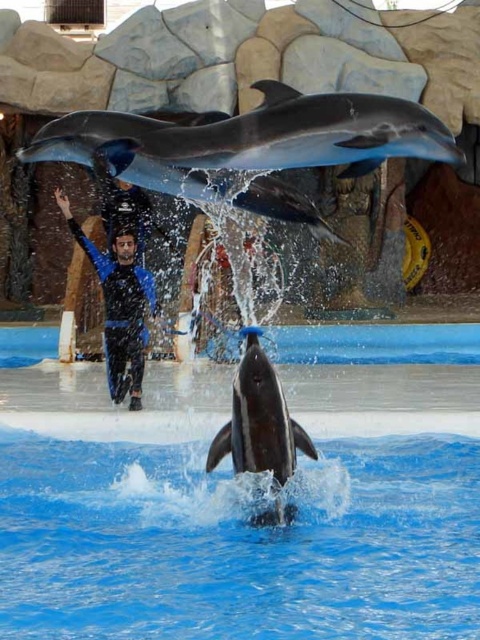
Does blue glossy water at center have a greater height compared to blue rubber suit at center?

No, blue glossy water at center is not taller than blue rubber suit at center.

Who is shorter, blue glossy water at center or blue rubber suit at center?

blue glossy water at center

Locate an element on the screen. This screenshot has width=480, height=640. blue glossy water at center is located at coordinates (243, 497).

Is the position of blue glossy water at center more distant than that of smooth gray dolphin at center?

No, it is not.

Is point (181, 412) less distant than point (277, 516)?

No, (181, 412) is behind (277, 516).

I want to click on blue glossy water at center, so click(x=243, y=497).

Does smooth gray dolphin at center have a smaller size compared to blue rubber suit at center?

Indeed, smooth gray dolphin at center has a smaller size compared to blue rubber suit at center.

Is smooth gray dolphin at center positioned before blue rubber suit at center?

Yes, smooth gray dolphin at center is closer to the viewer.

Identify the location of smooth gray dolphin at center. The image size is (480, 640). (259, 420).